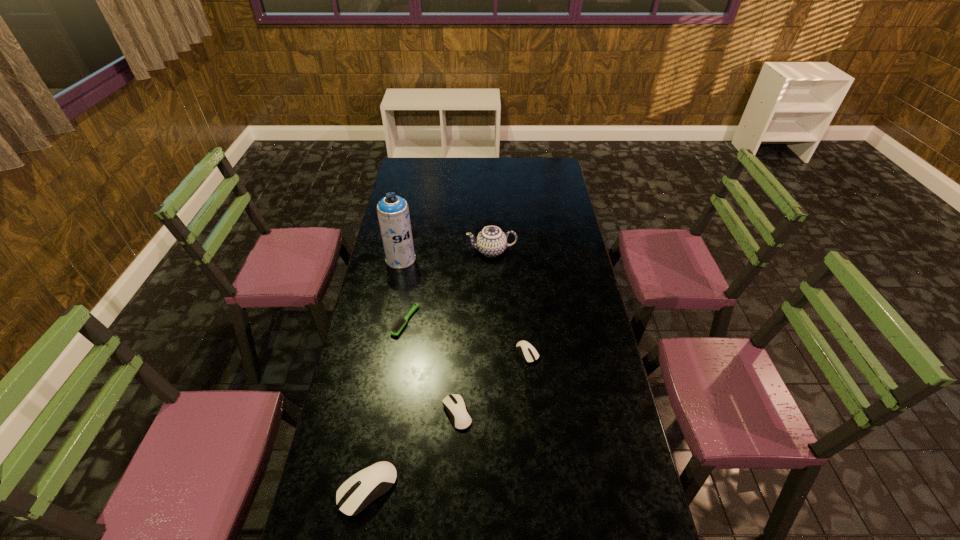
Find the location of a particular element. The width and height of the screenshot is (960, 540). the tallest mouse is located at coordinates (375, 480).

In order to click on the nearest object in this screenshot , I will do `click(375, 480)`.

Locate an element on the screen. the second shortest mouse is located at coordinates (460, 417).

You are a GUI agent. You are given a task and a screenshot of the screen. Output one action in this format:
    pyautogui.click(x=<x>, y=<y>)
    Task: Click on the fifth farthest object
    The width and height of the screenshot is (960, 540).
    Given the screenshot: What is the action you would take?
    pyautogui.click(x=460, y=417)

Identify the location of the fourth farthest object. point(529,354).

Locate an element on the screen. The height and width of the screenshot is (540, 960). the farthest mouse is located at coordinates (529, 354).

Locate an element on the screen. Image resolution: width=960 pixels, height=540 pixels. aerosol can is located at coordinates (393, 212).

Where is `the fifth shortest object`? The height and width of the screenshot is (540, 960). the fifth shortest object is located at coordinates (491, 241).

Where is `the fourth nearest object`? The width and height of the screenshot is (960, 540). the fourth nearest object is located at coordinates (400, 324).

I want to click on vacant space located on the right of the third tallest object, so click(520, 490).